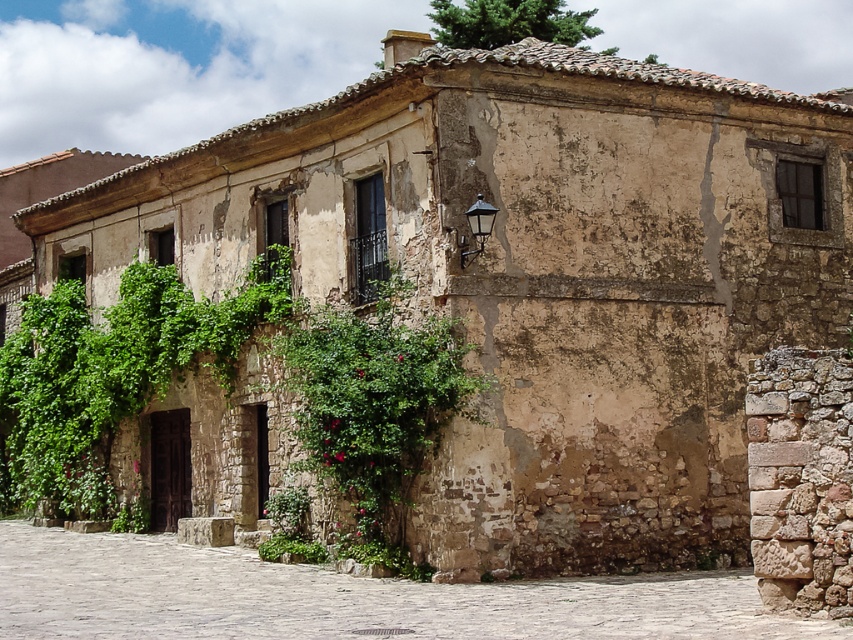
You are a delivery person with a cart that is 6 meters wide. You need to navigate through the stone paved alley at center and around the green leafy bush at center. Can your cart fit through the space between them?

The stone paved alley at center and green leafy bush at center are 5.90 meters apart from each other. Since your cart is 6 meters wide, it is slightly wider than the available space, so the cart cannot fit through the space between them.

You are standing in the middle of the stone paved alley at center and looking towards the green leafy bush at center. Which object is taller?

The stone paved alley at center is much taller than the green leafy bush at center.